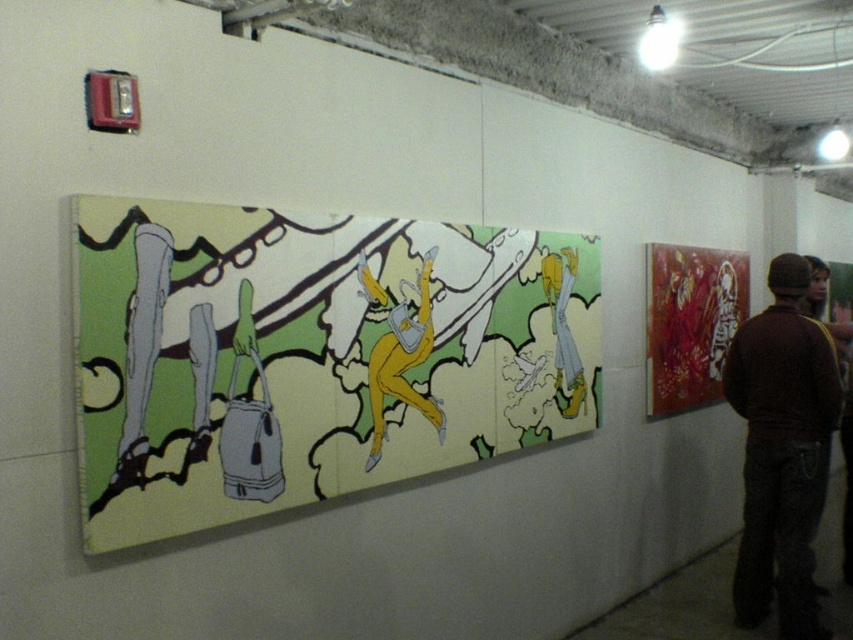
Between point (354, 272) and point (791, 444), which one is positioned in front?

Point (354, 272) is more forward.

Does matte canvas painting at center appear over brown sweater at right?

Yes.

What do you see at coordinates (311, 355) in the screenshot?
I see `matte canvas painting at center` at bounding box center [311, 355].

Where is `matte canvas painting at center`? matte canvas painting at center is located at coordinates (311, 355).